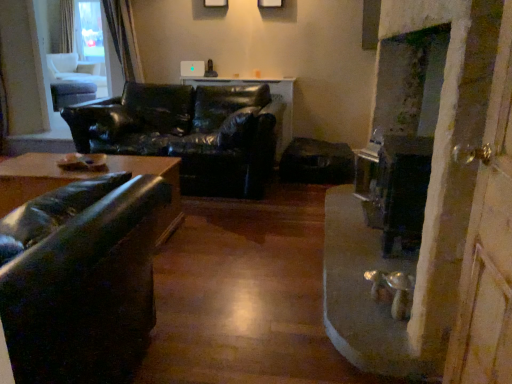
Question: Should I look upward or downward to see black leather couch at center, placed as the 1th studio couch when sorted from back to front?

Choices:
 (A) down
 (B) up

Answer: (B)

Question: Does black leather couch at center, the 2th studio couch when ordered from front to back, come behind wooden screen door at right?

Choices:
 (A) no
 (B) yes

Answer: (B)

Question: Is black leather couch at center, placed as the 1th studio couch when sorted from back to front, thinner than wooden screen door at right?

Choices:
 (A) yes
 (B) no

Answer: (B)

Question: Does black leather couch at center, the 2th studio couch when ordered from front to back, appear on the left side of wooden screen door at right?

Choices:
 (A) yes
 (B) no

Answer: (A)

Question: Is black leather couch at center, placed as the 1th studio couch when sorted from back to front, smaller than wooden screen door at right?

Choices:
 (A) yes
 (B) no

Answer: (B)

Question: Is wooden screen door at right surrounded by black leather couch at center, the 2th studio couch when ordered from front to back?

Choices:
 (A) yes
 (B) no

Answer: (B)

Question: From the image's perspective, is black leather couch at center, the 2th studio couch when ordered from front to back, on top of wooden screen door at right?

Choices:
 (A) yes
 (B) no

Answer: (A)

Question: Is wooden screen door at right further to camera compared to matte black couch at left, arranged as the second studio couch when viewed from the back?

Choices:
 (A) no
 (B) yes

Answer: (A)

Question: From a real-world perspective, is wooden screen door at right on top of matte black couch at left, acting as the first studio couch starting from the front?

Choices:
 (A) yes
 (B) no

Answer: (A)

Question: Does wooden screen door at right have a larger size compared to matte black couch at left, acting as the first studio couch starting from the front?

Choices:
 (A) no
 (B) yes

Answer: (A)

Question: Can you confirm if wooden screen door at right is positioned to the left of matte black couch at left, acting as the first studio couch starting from the front?

Choices:
 (A) no
 (B) yes

Answer: (A)

Question: Is wooden screen door at right positioned beyond the bounds of matte black couch at left, acting as the first studio couch starting from the front?

Choices:
 (A) yes
 (B) no

Answer: (A)

Question: Is wooden screen door at right thinner than matte black couch at left, arranged as the second studio couch when viewed from the back?

Choices:
 (A) no
 (B) yes

Answer: (B)

Question: Is wooden screen door at right placed right next to black leather couch at center, the 2th studio couch when ordered from front to back?

Choices:
 (A) yes
 (B) no

Answer: (B)